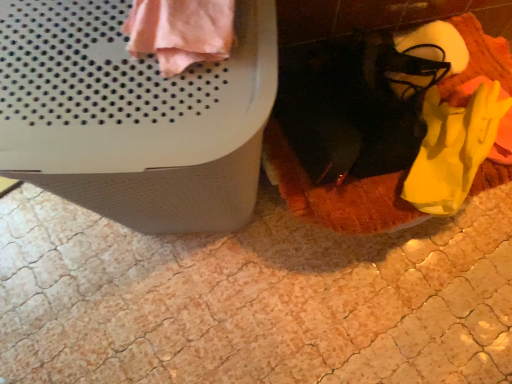
Question: Is yellow fabric shoe at lower right wider or thinner than pink fabric at upper left?

Choices:
 (A) wide
 (B) thin

Answer: (B)

Question: From a real-world perspective, is yellow fabric shoe at lower right positioned above or below pink fabric at upper left?

Choices:
 (A) below
 (B) above

Answer: (A)

Question: Which is nearer to the yellow fabric shoe at lower right?

Choices:
 (A) soft orange blanket at lower right
 (B) white textured waste container at upper left
 (C) pink fabric at upper left

Answer: (A)

Question: Which object is the farthest from the soft orange blanket at lower right?

Choices:
 (A) yellow fabric shoe at lower right
 (B) white textured waste container at upper left
 (C) pink fabric at upper left

Answer: (C)